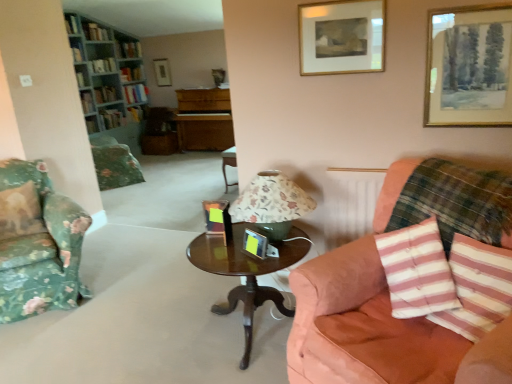
Question: Is the surface of hardcover book at upper left, the 2th book from the top, in direct contact with pink striped pillow at lower right, marked as the 2th pillow in a right-to-left arrangement?

Choices:
 (A) no
 (B) yes

Answer: (A)

Question: Is hardcover book at upper left, the 2th book from the top, taller than pink striped pillow at lower right, the 1th pillow viewed from the front?

Choices:
 (A) yes
 (B) no

Answer: (A)

Question: Can you confirm if hardcover book at upper left, the 2th book from the top, is shorter than pink striped pillow at lower right, marked as the 2th pillow in a right-to-left arrangement?

Choices:
 (A) yes
 (B) no

Answer: (B)

Question: Does hardcover book at upper left, the 2th book from the top, have a greater width compared to pink striped pillow at lower right, positioned as the second pillow in left-to-right order?

Choices:
 (A) no
 (B) yes

Answer: (B)

Question: Is hardcover book at upper left, the 2th book from the top, positioned far away from pink striped pillow at lower right, the 3th pillow viewed from the back?

Choices:
 (A) no
 (B) yes

Answer: (B)

Question: From the image's perspective, is hardcover book at upper left, the 2th book from the top, on pink striped pillow at lower right, the 1th pillow viewed from the front?

Choices:
 (A) no
 (B) yes

Answer: (B)

Question: Does hardcover book at upper left, the 7th book ordered from the bottom, have a smaller size compared to hardcover book at upper left, arranged as the 9th book when ordered from the bottom?

Choices:
 (A) no
 (B) yes

Answer: (A)

Question: Considering the relative sizes of hardcover book at upper left, the 7th book ordered from the bottom, and hardcover book at upper left, arranged as the 9th book when ordered from the bottom, in the image provided, is hardcover book at upper left, the 7th book ordered from the bottom, taller than hardcover book at upper left, arranged as the 9th book when ordered from the bottom,?

Choices:
 (A) no
 (B) yes

Answer: (B)

Question: From the image's perspective, is hardcover book at upper left, the fifth book positioned from the top, on hardcover book at upper left, arranged as the 9th book when ordered from the bottom?

Choices:
 (A) no
 (B) yes

Answer: (A)

Question: Can you confirm if hardcover book at upper left, the fifth book positioned from the top, is wider than hardcover book at upper left, arranged as the 9th book when ordered from the bottom?

Choices:
 (A) yes
 (B) no

Answer: (B)

Question: Is hardcover book at upper left, arranged as the 9th book when ordered from the bottom, surrounded by hardcover book at upper left, the fifth book positioned from the top?

Choices:
 (A) yes
 (B) no

Answer: (B)

Question: Can we say hardcover book at upper left, the fifth book positioned from the top, lies outside hardcover book at upper left, arranged as the 9th book when ordered from the bottom?

Choices:
 (A) yes
 (B) no

Answer: (A)

Question: Is hardcover book at upper left, which ranks as the 11th book in bottom-to-top order, next to pink striped cushion at right, the third pillow viewed from the left, and touching it?

Choices:
 (A) no
 (B) yes

Answer: (A)